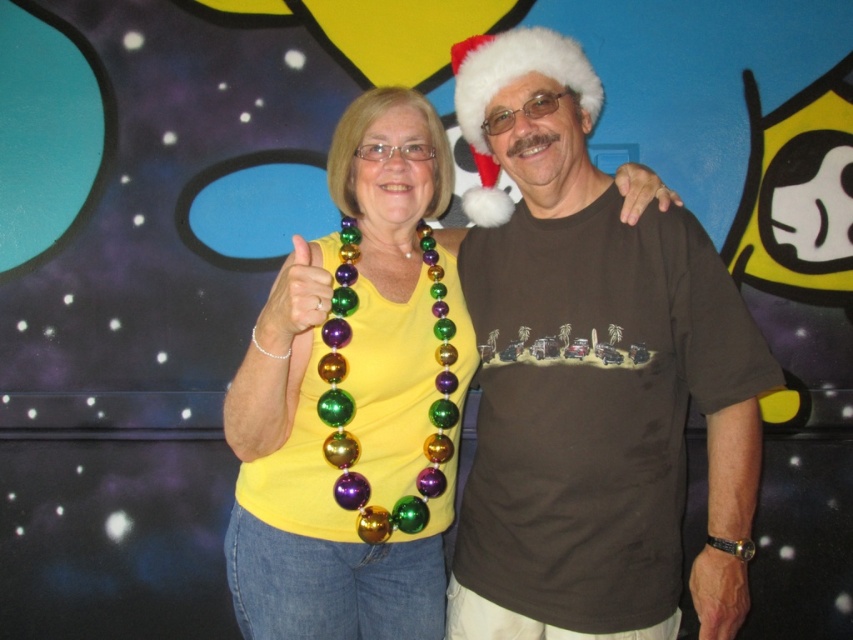
Question: Which point is closer to the camera taking this photo?

Choices:
 (A) (582, 106)
 (B) (415, 372)

Answer: (A)

Question: Is brown cotton t-shirt at center above yellow matte shirt at center?

Choices:
 (A) no
 (B) yes

Answer: (B)

Question: Among these objects, which one is nearest to the camera?

Choices:
 (A) yellow matte shirt at center
 (B) brown cotton t-shirt at center

Answer: (A)

Question: Does brown cotton t-shirt at center lie in front of yellow matte shirt at center?

Choices:
 (A) yes
 (B) no

Answer: (B)

Question: Is brown cotton t-shirt at center to the left of yellow matte shirt at center from the viewer's perspective?

Choices:
 (A) no
 (B) yes

Answer: (A)